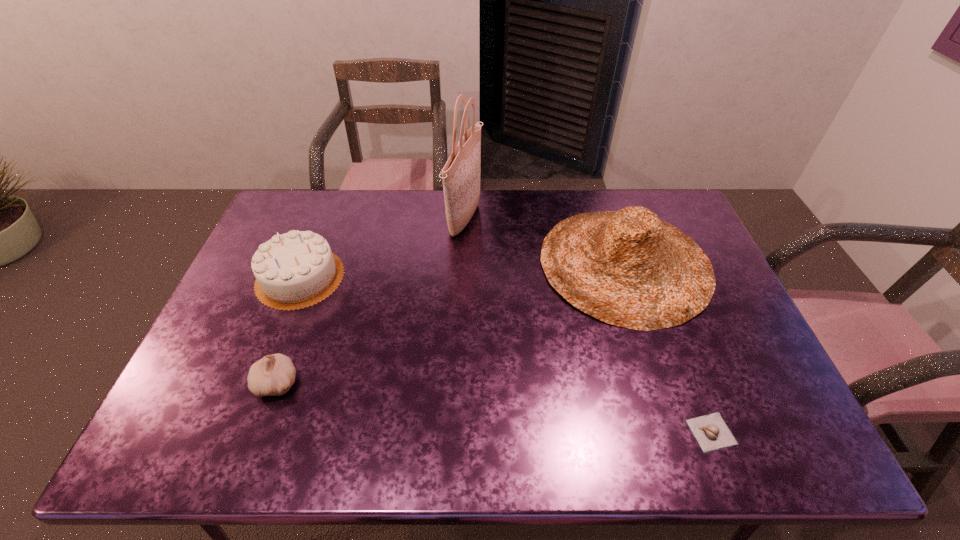
You are a GUI agent. You are given a task and a screenshot of the screen. Output one action in this format:
    pyautogui.click(x=<x>, y=<y>)
    Task: Click on the object located in the near right corner section of the desktop
    This screenshot has height=540, width=960.
    Given the screenshot: What is the action you would take?
    pyautogui.click(x=711, y=432)

You are a GUI agent. You are given a task and a screenshot of the screen. Output one action in this format:
    pyautogui.click(x=<x>, y=<y>)
    Task: Click on the vacant space at the far edge
    
    Given the screenshot: What is the action you would take?
    pyautogui.click(x=517, y=218)

The image size is (960, 540). What are the coordinates of `vacant space at the near edge of the desktop` in the screenshot? It's located at (285, 445).

The width and height of the screenshot is (960, 540). In order to click on vacant space at the left edge of the desktop in this screenshot , I will do `click(262, 322)`.

Identify the location of vacant region at the right edge of the desktop. (722, 306).

Locate an element on the screen. vacant space at the far left corner is located at coordinates (291, 194).

Identify the location of free space at the far right corner of the desktop. [663, 210].

The height and width of the screenshot is (540, 960). I want to click on unoccupied area between the shortest object and the fourth shortest object, so click(x=668, y=348).

This screenshot has height=540, width=960. I want to click on free space between the third object from left to right and the birthday cake, so click(382, 249).

Image resolution: width=960 pixels, height=540 pixels. In order to click on free space that is in between the sunhat and the farther garlic in this screenshot , I will do `click(451, 323)`.